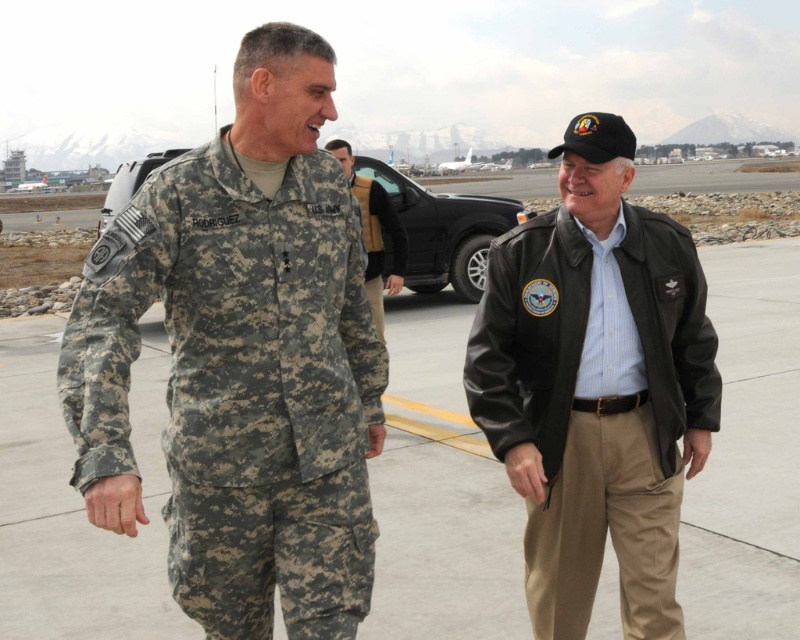
You are a photographer trying to capture both the camouflage uniform at left and the camouflage fabric uniform at left in a single frame. Which one is closer to you so that you can focus on it first?

The camouflage uniform at left is closer to you than the camouflage fabric uniform at left, so you should focus on the camouflage uniform at left first.

You are a photographer trying to capture both individuals in a single frame. Since the camouflage uniform at left and the camouflage fabric uniform at left are both present, which one is wider and might require more space in the frame?

The camouflage uniform at left is wider than the camouflage fabric uniform at left, so it requires more space in the frame.